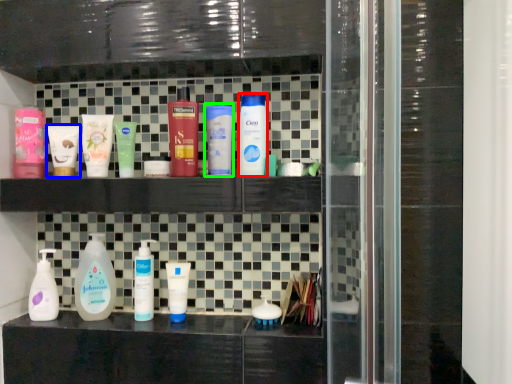
Question: Which object is the closest to the cleaning product (highlighted by a red box)? Choose among these: toiletry (highlighted by a blue box) or toiletry (highlighted by a green box).

Choices:
 (A) toiletry
 (B) toiletry

Answer: (B)